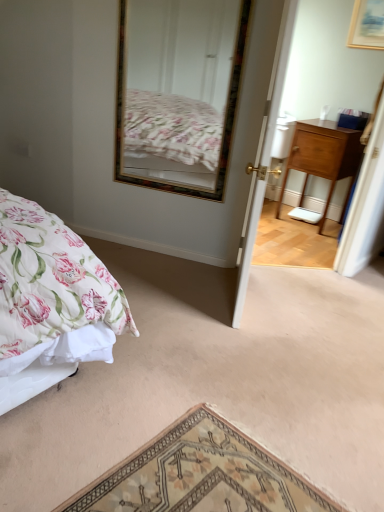
Question: Would you say wooden picture frame at upper right is a long distance from wooden-framed mirror at upper center?

Choices:
 (A) no
 (B) yes

Answer: (B)

Question: Is wooden picture frame at upper right positioned with its back to wooden-framed mirror at upper center?

Choices:
 (A) yes
 (B) no

Answer: (B)

Question: Is wooden picture frame at upper right to the right of wooden-framed mirror at upper center from the viewer's perspective?

Choices:
 (A) yes
 (B) no

Answer: (A)

Question: Does wooden picture frame at upper right have a smaller size compared to wooden-framed mirror at upper center?

Choices:
 (A) yes
 (B) no

Answer: (A)

Question: Does wooden picture frame at upper right have a lesser width compared to wooden-framed mirror at upper center?

Choices:
 (A) yes
 (B) no

Answer: (A)

Question: Considering the relative positions of wooden picture frame at upper right and wooden-framed mirror at upper center in the image provided, is wooden picture frame at upper right in front of wooden-framed mirror at upper center?

Choices:
 (A) no
 (B) yes

Answer: (A)

Question: Is white wooden door at center inside wooden-framed mirror at upper center?

Choices:
 (A) no
 (B) yes

Answer: (A)

Question: Is wooden-framed mirror at upper center outside white wooden door at center?

Choices:
 (A) no
 (B) yes

Answer: (B)

Question: Considering the relative sizes of wooden-framed mirror at upper center and white wooden door at center in the image provided, is wooden-framed mirror at upper center shorter than white wooden door at center?

Choices:
 (A) yes
 (B) no

Answer: (A)

Question: Is wooden-framed mirror at upper center facing away from white wooden door at center?

Choices:
 (A) no
 (B) yes

Answer: (A)

Question: Is the surface of wooden-framed mirror at upper center in direct contact with white wooden door at center?

Choices:
 (A) yes
 (B) no

Answer: (B)

Question: From the image's perspective, is wooden-framed mirror at upper center under white wooden door at center?

Choices:
 (A) yes
 (B) no

Answer: (B)

Question: Does wooden nightstand at right have a greater height compared to wooden-framed mirror at upper center?

Choices:
 (A) yes
 (B) no

Answer: (B)